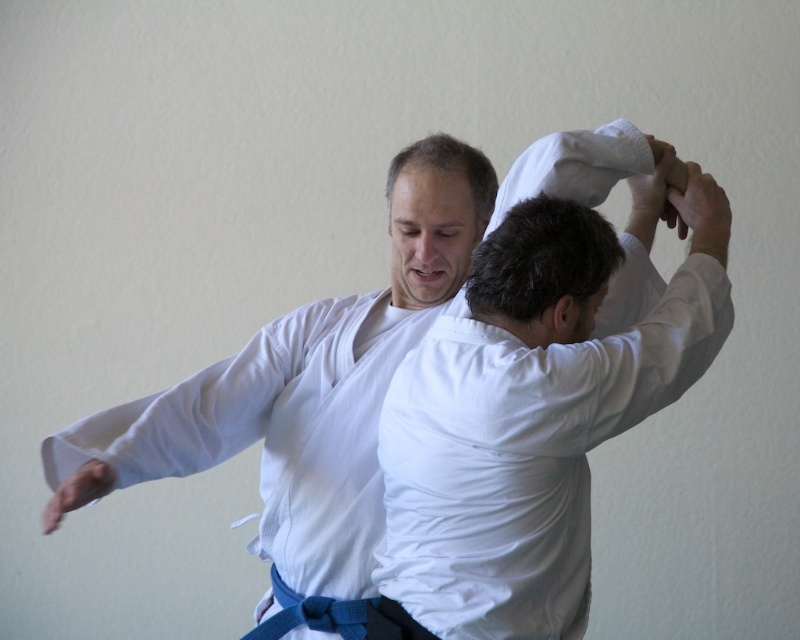
You are a tailor who needs to determine which garment requires more fabric to alter. You see a white cotton kimono at center and a white cotton shirt at center. Which one needs more fabric for alterations?

The white cotton kimono at center requires more fabric for alterations since it is bigger than the white cotton shirt at center.

In the scene where two people are practicing martial arts, both wearing white clothing, can you tell me which piece of clothing is positioned to the left? The options are the white cotton kimono at center and the white cotton shirt at center.

The white cotton kimono at center is positioned to the left of the white cotton shirt at center.

You are organizing a martial arts demonstration and need to ensure that all participants are wearing appropriate attire. You notice two items of clothing at the center of the image. Which one is wider between the white cotton kimono at center and the white cotton shirt at center?

The white cotton kimono at center is wider than the white cotton shirt at center.